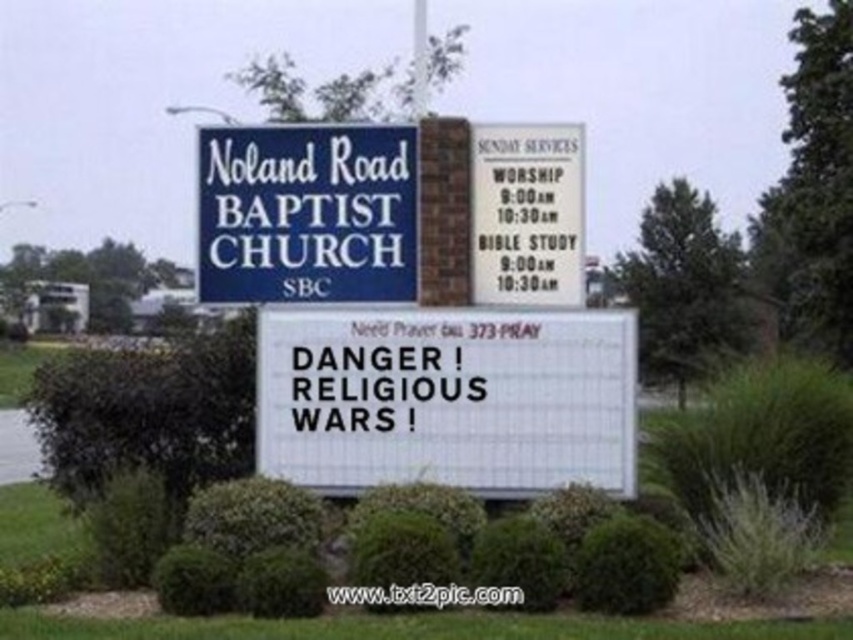
Between white plastic sign at center and blue painted wood sign at upper center, which one appears on the right side from the viewer's perspective?

white plastic sign at center is more to the right.

Can you confirm if white plastic sign at center is wider than blue painted wood sign at upper center?

Yes, white plastic sign at center is wider than blue painted wood sign at upper center.

Between point (329, 378) and point (355, 173), which one is positioned in front?

Point (329, 378)

The height and width of the screenshot is (640, 853). Find the location of `white plastic sign at center`. white plastic sign at center is located at coordinates [445, 397].